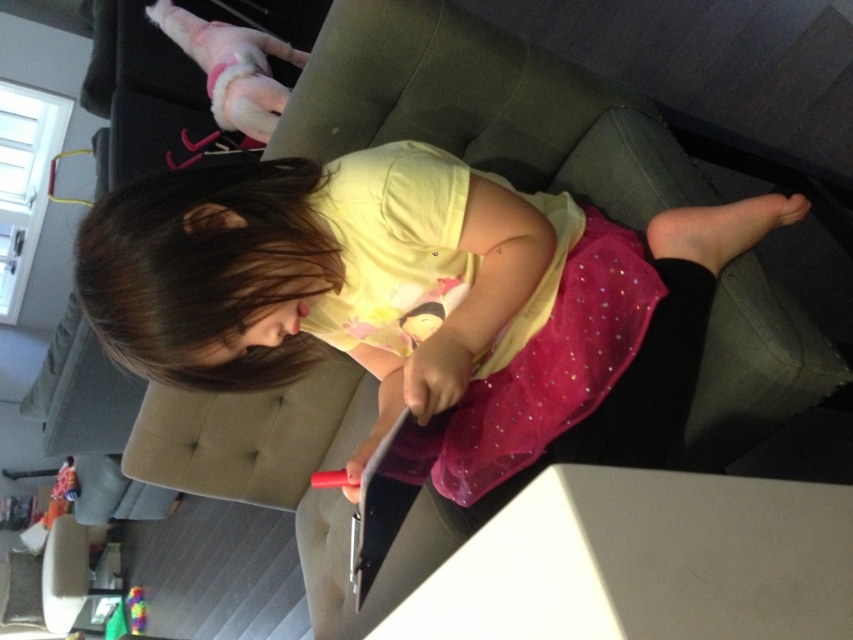
You are a fashion designer observing the child in the living room. You need to decide which item is wider between the pink tulle skirt at center and the multicolored plastic toy at lower left. Which one is wider?

The pink tulle skirt at center is wider than the multicolored plastic toy at lower left.

You are taking a photo of the living room scene. You want to focus on the point at point (x=77, y=488) and point (x=129, y=593). Which point should you focus on first to ensure it is in sharp focus?

Point (x=77, y=488) is closer to the camera than point (x=129, y=593), so you should focus on point (x=77, y=488) first to ensure it is in sharp focus.